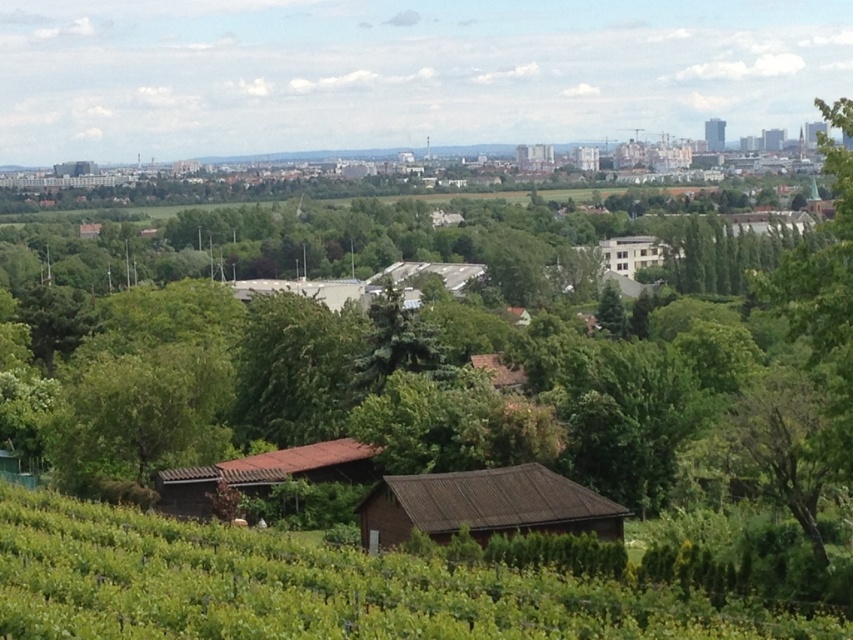
You are planning to build a garden and have two options for locations in the image. One is the green grassy hillside at lower center and the other is the area near the white wooden house at right. Which location offers more space for the garden?

The white wooden house at right has a larger area compared to the green grassy hillside at lower center, so the area near the white wooden house at right offers more space for the garden.

Based on the provided scene description, where is the green grassy hillside at lower center located in terms of its 2D coordinates?

The green grassy hillside at lower center is located at the 2D coordinates point (308, 588).